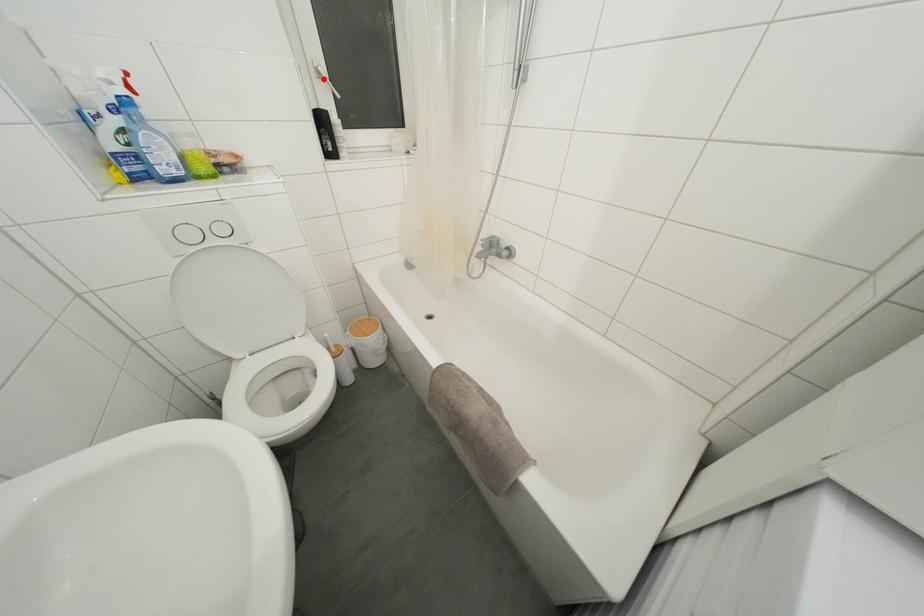
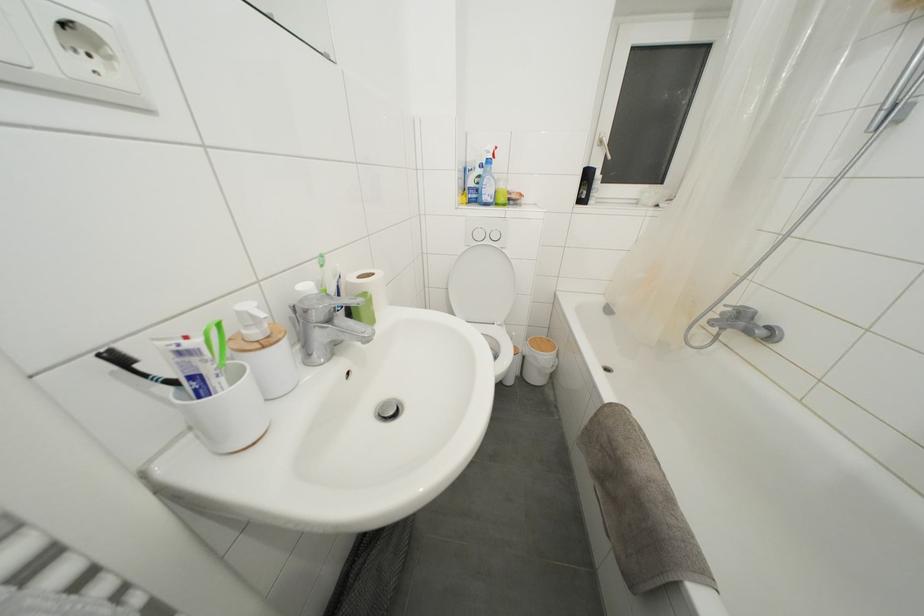
The point at the highlighted location is marked in the first image. Where is the corresponding point in the second image?

(604, 148)